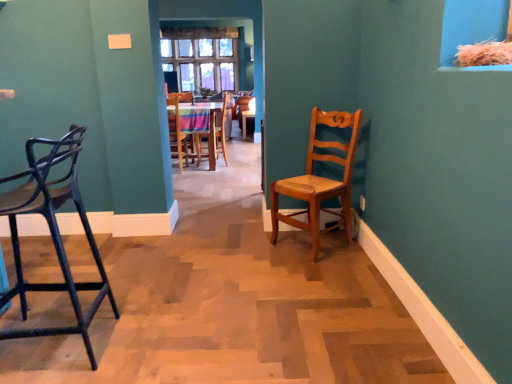
How much space does light brown wooden chair at center, which is counted as the 2th chair, starting from the front, occupy vertically?

light brown wooden chair at center, which is counted as the 2th chair, starting from the front, is 37.26 inches tall.

What do you see at coordinates (320, 178) in the screenshot?
I see `light brown wooden chair at center, which is counted as the 2th chair, starting from the front` at bounding box center [320, 178].

The image size is (512, 384). What do you see at coordinates (176, 132) in the screenshot?
I see `wooden chair at center, the third chair in the back-to-front sequence` at bounding box center [176, 132].

Find the location of a particular element. wooden chair at center, which is counted as the second chair, starting from the back is located at coordinates (199, 127).

The image size is (512, 384). In order to click on wooden chair at center, the fifth chair when ordered from front to back in this screenshot , I will do `click(213, 137)`.

Where is `light brown wooden chair at center, which is counted as the 2th chair, starting from the front`? This screenshot has width=512, height=384. light brown wooden chair at center, which is counted as the 2th chair, starting from the front is located at coordinates pos(320,178).

Between wooden chair at center, the fifth chair when ordered from front to back, and wooden chair at center, the third chair in the back-to-front sequence, which one is positioned in front?

wooden chair at center, the third chair in the back-to-front sequence, is closer to the camera.

Does point (212, 126) appear closer or farther from the camera than point (183, 150)?

Point (212, 126) appears to be closer to the viewer than point (183, 150).

From a real-world perspective, is wooden chair at center, the first chair when ordered from back to front, above or below wooden chair at center, the 3th chair positioned from the front?

wooden chair at center, the first chair when ordered from back to front, is above wooden chair at center, the 3th chair positioned from the front.

From the image's perspective, which is below, wooden chair at center, the fifth chair when ordered from front to back, or wooden chair at center, the 3th chair positioned from the front?

wooden chair at center, the 3th chair positioned from the front.

Between matte black stool at left, the 5th chair viewed from the back, and light brown wooden chair at center, which ranks as the fourth chair in back-to-front order, which one has smaller size?

Smaller between the two is light brown wooden chair at center, which ranks as the fourth chair in back-to-front order.

From the image's perspective, is matte black stool at left, the 5th chair viewed from the back, located above light brown wooden chair at center, which is counted as the 2th chair, starting from the front?

Incorrect, from the image's perspective, matte black stool at left, the 5th chair viewed from the back, is lower than light brown wooden chair at center, which is counted as the 2th chair, starting from the front.

Are matte black stool at left, the 5th chair viewed from the back, and light brown wooden chair at center, which is counted as the 2th chair, starting from the front, far apart?

matte black stool at left, the 5th chair viewed from the back, is positioned a significant distance from light brown wooden chair at center, which is counted as the 2th chair, starting from the front.

From their relative heights in the image, would you say matte black stool at left, the 5th chair viewed from the back, is taller or shorter than light brown wooden chair at center, which ranks as the fourth chair in back-to-front order?

matte black stool at left, the 5th chair viewed from the back, is taller than light brown wooden chair at center, which ranks as the fourth chair in back-to-front order.

From the picture: Considering the relative sizes of wooden chair at center, the 4th chair from the front, and matte black stool at left, which is counted as the first chair, starting from the front, in the image provided, is wooden chair at center, the 4th chair from the front, wider than matte black stool at left, which is counted as the first chair, starting from the front,?

Yes, wooden chair at center, the 4th chair from the front, is wider than matte black stool at left, which is counted as the first chair, starting from the front.

Who is taller, wooden chair at center, which is counted as the second chair, starting from the back, or matte black stool at left, which is counted as the first chair, starting from the front?

matte black stool at left, which is counted as the first chair, starting from the front, is taller.

From the image's perspective, between wooden chair at center, the 4th chair from the front, and matte black stool at left, which is counted as the first chair, starting from the front, who is located below?

matte black stool at left, which is counted as the first chair, starting from the front, from the image's perspective.

Considering the sizes of objects wooden chair at center, which is counted as the second chair, starting from the back, and matte black stool at left, which is counted as the first chair, starting from the front, in the image provided, who is smaller, wooden chair at center, which is counted as the second chair, starting from the back, or matte black stool at left, which is counted as the first chair, starting from the front,?

matte black stool at left, which is counted as the first chair, starting from the front.

Is wooden chair at center, the third chair in the back-to-front sequence, taller or shorter than wooden chair at center, which is counted as the second chair, starting from the back?

Clearly, wooden chair at center, the third chair in the back-to-front sequence, is taller compared to wooden chair at center, which is counted as the second chair, starting from the back.

From the image's perspective, which one is positioned lower, wooden chair at center, the 3th chair positioned from the front, or wooden chair at center, which is counted as the second chair, starting from the back?

From the image's view, wooden chair at center, the 3th chair positioned from the front, is below.

Which object is thinner, wooden chair at center, the third chair in the back-to-front sequence, or wooden chair at center, the 4th chair from the front?

With smaller width is wooden chair at center, the third chair in the back-to-front sequence.

Is matte black stool at left, which is counted as the first chair, starting from the front, situated inside wooden chair at center, the third chair in the back-to-front sequence, or outside?

matte black stool at left, which is counted as the first chair, starting from the front, is spatially situated outside wooden chair at center, the third chair in the back-to-front sequence.

Considering the positions of point (16, 221) and point (173, 154), is point (16, 221) closer or farther from the camera than point (173, 154)?

Point (16, 221) is positioned closer to the camera compared to point (173, 154).

Considering the sizes of objects matte black stool at left, the 5th chair viewed from the back, and wooden chair at center, the third chair in the back-to-front sequence, in the image provided, who is taller, matte black stool at left, the 5th chair viewed from the back, or wooden chair at center, the third chair in the back-to-front sequence,?

matte black stool at left, the 5th chair viewed from the back.

Which is further, (346, 230) or (212, 150)?

The point (212, 150) is more distant.

Is light brown wooden chair at center, which ranks as the fourth chair in back-to-front order, oriented away from wooden chair at center, the fifth chair when ordered from front to back?

light brown wooden chair at center, which ranks as the fourth chair in back-to-front order, is not turned away from wooden chair at center, the fifth chair when ordered from front to back.

Looking at this image, who is taller, light brown wooden chair at center, which ranks as the fourth chair in back-to-front order, or wooden chair at center, the first chair when ordered from back to front?

Standing taller between the two is wooden chair at center, the first chair when ordered from back to front.

Is matte black stool at left, which is counted as the first chair, starting from the front, spatially inside wooden chair at center, the 4th chair from the front, or outside of it?

matte black stool at left, which is counted as the first chair, starting from the front, is not inside wooden chair at center, the 4th chair from the front, it's outside.

Starting from the matte black stool at left, the 5th chair viewed from the back, which chair is the 3rd one behind? Please provide its 2D coordinates.

[(199, 127)]

Can you tell me how much matte black stool at left, the 5th chair viewed from the back, and wooden chair at center, the 4th chair from the front, differ in facing direction?

matte black stool at left, the 5th chair viewed from the back, and wooden chair at center, the 4th chair from the front, are facing 88 degrees away from each other.

From a real-world perspective, is matte black stool at left, the 5th chair viewed from the back, physically below wooden chair at center, the 4th chair from the front?

Actually, matte black stool at left, the 5th chair viewed from the back, is physically above wooden chair at center, the 4th chair from the front, in the real world.

Identify the location of chair that is the 2nd object located in front of the wooden chair at center, the fifth chair when ordered from front to back. This screenshot has height=384, width=512. (176, 132).

Locate an element on the screen. The width and height of the screenshot is (512, 384). chair that is the 3rd object to the left of the light brown wooden chair at center, which ranks as the fourth chair in back-to-front order, starting at the anchor is located at coordinates pyautogui.click(x=53, y=233).

When comparing their distances from light brown wooden chair at center, which is counted as the 2th chair, starting from the front, does matte black stool at left, which is counted as the first chair, starting from the front, or wooden chair at center, the third chair in the back-to-front sequence, seem closer?

matte black stool at left, which is counted as the first chair, starting from the front, is positioned closer to the anchor light brown wooden chair at center, which is counted as the 2th chair, starting from the front.

Based on their spatial positions, is light brown wooden chair at center, which is counted as the 2th chair, starting from the front, or matte black stool at left, the 5th chair viewed from the back, closer to wooden chair at center, which is counted as the second chair, starting from the back?

The object closer to wooden chair at center, which is counted as the second chair, starting from the back, is light brown wooden chair at center, which is counted as the 2th chair, starting from the front.

Which object lies nearer to the anchor point wooden chair at center, the 4th chair from the front, matte black stool at left, the 5th chair viewed from the back, or light brown wooden chair at center, which is counted as the 2th chair, starting from the front?

light brown wooden chair at center, which is counted as the 2th chair, starting from the front, is positioned closer to the anchor wooden chair at center, the 4th chair from the front.

Which object lies nearer to the anchor point wooden chair at center, the fifth chair when ordered from front to back, wooden chair at center, which is counted as the second chair, starting from the back, or matte black stool at left, which is counted as the first chair, starting from the front?

Based on the image, wooden chair at center, which is counted as the second chair, starting from the back, appears to be nearer to wooden chair at center, the fifth chair when ordered from front to back.

Based on their spatial positions, is light brown wooden chair at center, which is counted as the 2th chair, starting from the front, or wooden chair at center, the first chair when ordered from back to front, further from matte black stool at left, which is counted as the first chair, starting from the front?

The object further to matte black stool at left, which is counted as the first chair, starting from the front, is wooden chair at center, the first chair when ordered from back to front.

Which object lies further to the anchor point wooden chair at center, the third chair in the back-to-front sequence, light brown wooden chair at center, which is counted as the 2th chair, starting from the front, or matte black stool at left, which is counted as the first chair, starting from the front?

matte black stool at left, which is counted as the first chair, starting from the front, lies further to wooden chair at center, the third chair in the back-to-front sequence, than the other object.

Estimate the real-world distances between objects in this image. Which object is closer to matte black stool at left, the 5th chair viewed from the back, light brown wooden chair at center, which is counted as the 2th chair, starting from the front, or wooden chair at center, the 3th chair positioned from the front?

light brown wooden chair at center, which is counted as the 2th chair, starting from the front.

From the picture: Considering their positions, is wooden chair at center, the first chair when ordered from back to front, positioned further to wooden chair at center, the 3th chair positioned from the front, than wooden chair at center, which is counted as the second chair, starting from the back?

Among the two, wooden chair at center, the first chair when ordered from back to front, is located further to wooden chair at center, the 3th chair positioned from the front.

Identify the location of chair between light brown wooden chair at center, which is counted as the 2th chair, starting from the front, and wooden chair at center, which is counted as the second chair, starting from the back, along the z-axis. The image size is (512, 384). (176, 132).

Locate an element on the screen. This screenshot has height=384, width=512. chair between matte black stool at left, the 5th chair viewed from the back, and wooden chair at center, the 3th chair positioned from the front, from front to back is located at coordinates (320, 178).